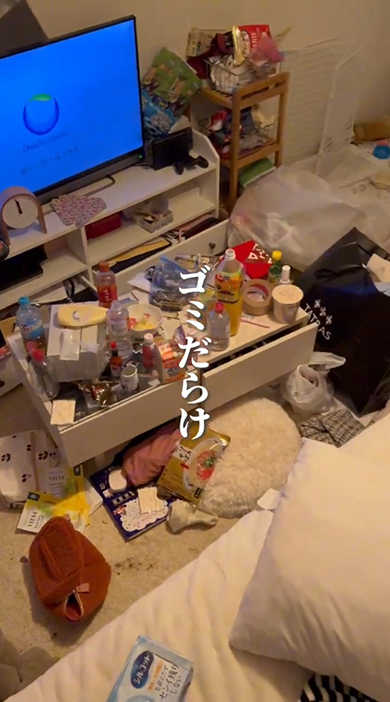
At what (x,y) coordinates should I click in order to perform the action: click on pillow. Please return your answer as a coordinate pair (x, y). Looking at the image, I should click on (342, 581).